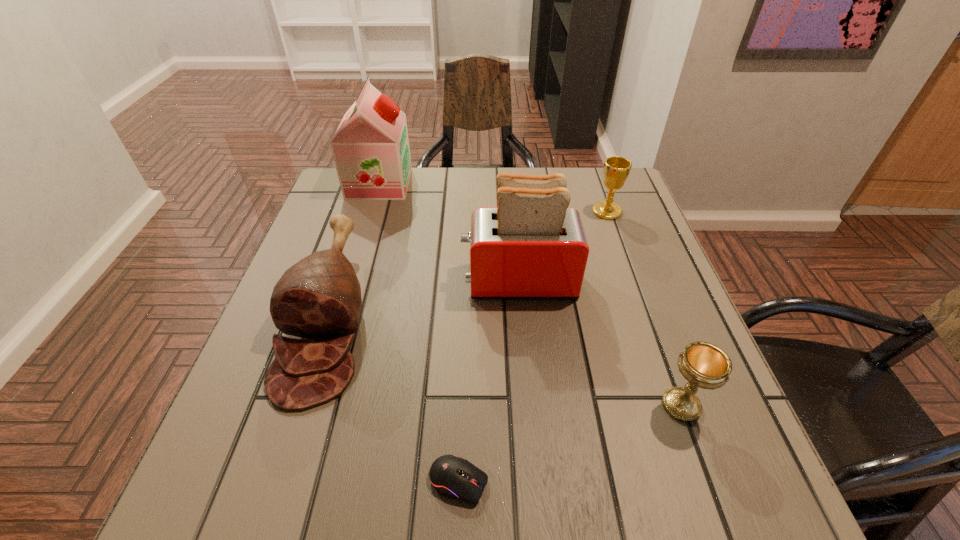
I want to click on empty space between the toaster and the nearer chalice, so click(x=600, y=343).

You are a GUI agent. You are given a task and a screenshot of the screen. Output one action in this format:
    pyautogui.click(x=<x>, y=<y>)
    Task: Click on the vacant area that lies between the nearer chalice and the toaster
    The width and height of the screenshot is (960, 540).
    Given the screenshot: What is the action you would take?
    pyautogui.click(x=600, y=343)

I want to click on free space between the nearer chalice and the farther chalice, so click(644, 308).

At what (x,y) coordinates should I click in order to perform the action: click on vacant space in between the toaster and the ham. Please return your answer as a coordinate pair (x, y). The height and width of the screenshot is (540, 960). Looking at the image, I should click on (424, 298).

Locate an element on the screen. object that can be found as the second closest to the farther chalice is located at coordinates (704, 365).

Choose which object is the third nearest neighbor to the second farthest object. Please provide its 2D coordinates. Your answer should be formatted as a tuple, i.e. [(x, y)], where the tuple contains the x and y coordinates of a point satisfying the conditions above.

[(370, 147)]

The height and width of the screenshot is (540, 960). What are the coordinates of `free space that satisfies the following two spatial constraints: 1. with the cap open on the soya milk; 2. at the sliced end of the ham` in the screenshot? It's located at (340, 315).

Find the location of a particular element. vacant space that satisfies the following two spatial constraints: 1. with the cap open on the soya milk; 2. at the sliced end of the ham is located at coordinates click(x=340, y=315).

The height and width of the screenshot is (540, 960). In order to click on vacant point that satisfies the following two spatial constraints: 1. with the cap open on the nearer chalice; 2. on the right side of the soya milk in this screenshot , I will do `click(312, 406)`.

Find the location of a particular element. vacant space that satisfies the following two spatial constraints: 1. on the front-facing side of the toaster; 2. at the sliced end of the ham is located at coordinates (521, 315).